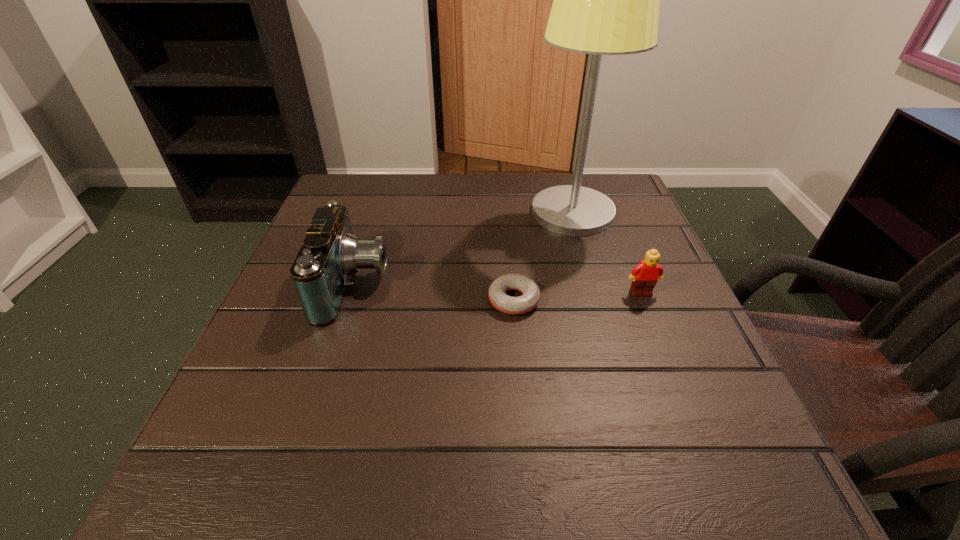
Identify the location of table lamp. (605, 0).

In order to click on the farthest object in this screenshot , I will do `click(605, 0)`.

Identify the location of the third shortest object. Image resolution: width=960 pixels, height=540 pixels. (330, 254).

Locate an element on the screen. This screenshot has height=540, width=960. the leftmost object is located at coordinates (330, 254).

What are the coordinates of `the second shortest object` in the screenshot? It's located at (644, 276).

The height and width of the screenshot is (540, 960). Find the location of `the shortest object`. the shortest object is located at coordinates (499, 299).

I want to click on doughnut, so click(499, 299).

Locate an element on the screen. The width and height of the screenshot is (960, 540). vacant position located on the front of the farthest object is located at coordinates (618, 370).

The height and width of the screenshot is (540, 960). Find the location of `free region located 0.400m on the front-facing side of the camcorder`. free region located 0.400m on the front-facing side of the camcorder is located at coordinates (589, 285).

Where is `free space located 0.080m on the face of the Lego`? Image resolution: width=960 pixels, height=540 pixels. free space located 0.080m on the face of the Lego is located at coordinates (656, 328).